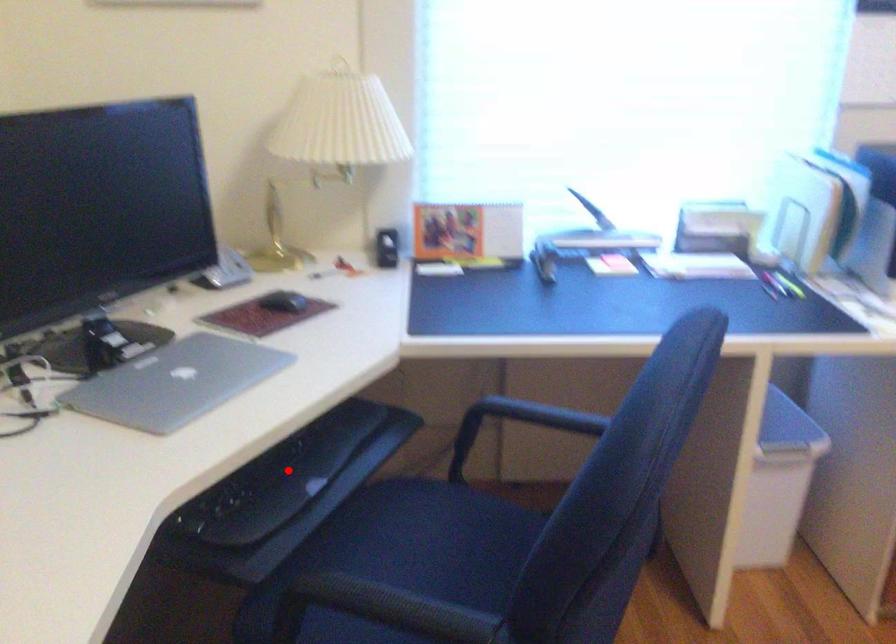
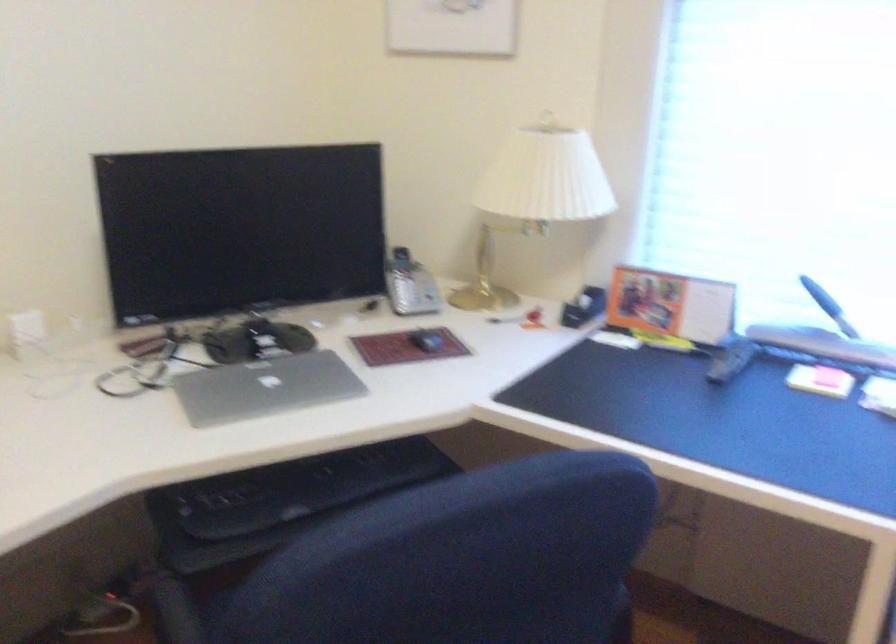
Question: I am providing you with two images of the same scene from different viewpoints. Image1 has a red point marked. In image2, the corresponding 3D location appears at what relative position? Reply with the corresponding letter.

Choices:
 (A) Closer
 (B) Farther

Answer: (B)